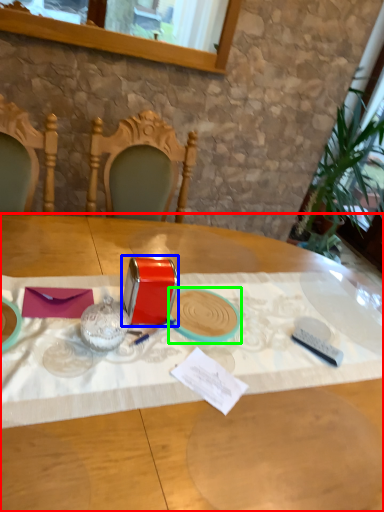
Question: Which is nearer to the table (highlighted by a red box)? tableware (highlighted by a blue box) or tableware (highlighted by a green box).

Choices:
 (A) tableware
 (B) tableware

Answer: (A)